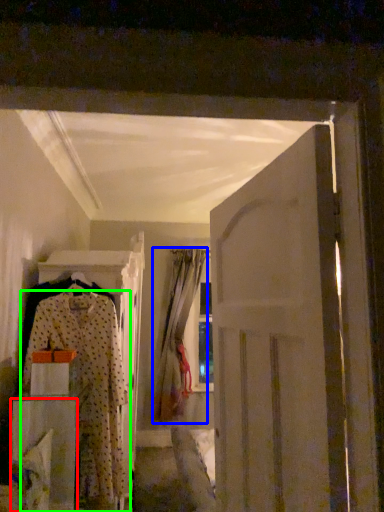
Question: Which is farther away from furniture (highlighted by a red box)? curtain (highlighted by a blue box) or fancy dress (highlighted by a green box)?

Choices:
 (A) curtain
 (B) fancy dress

Answer: (A)